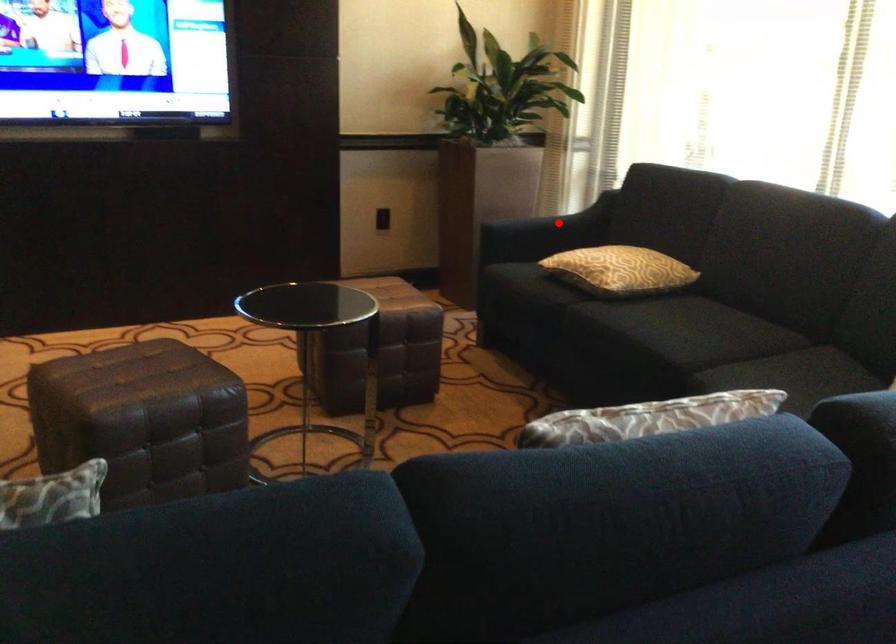
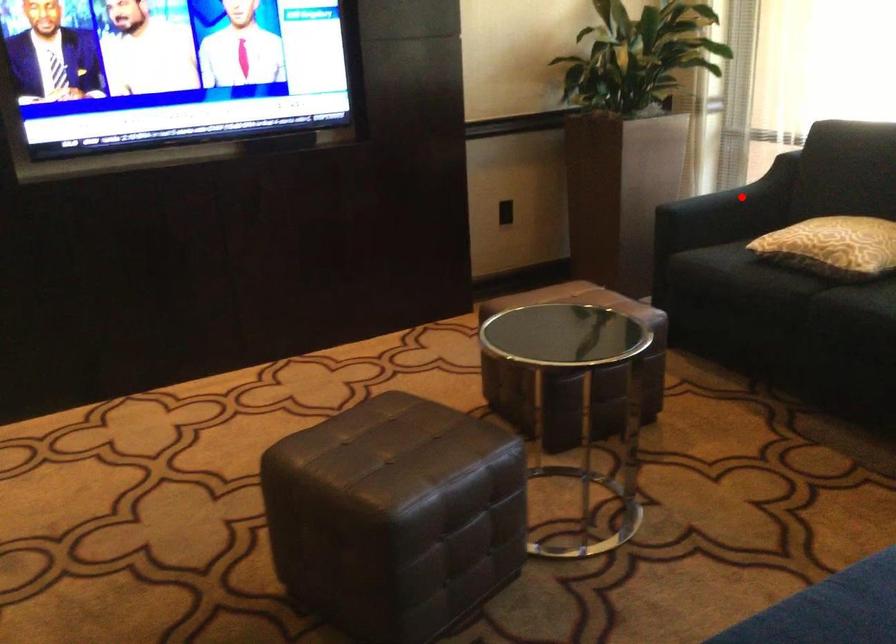
I am providing you with two images of the same scene from different viewpoints. A red point is marked on the first image and another point is marked on the second image. Is the marked point in image1 the same physical position as the marked point in image2?

Yes